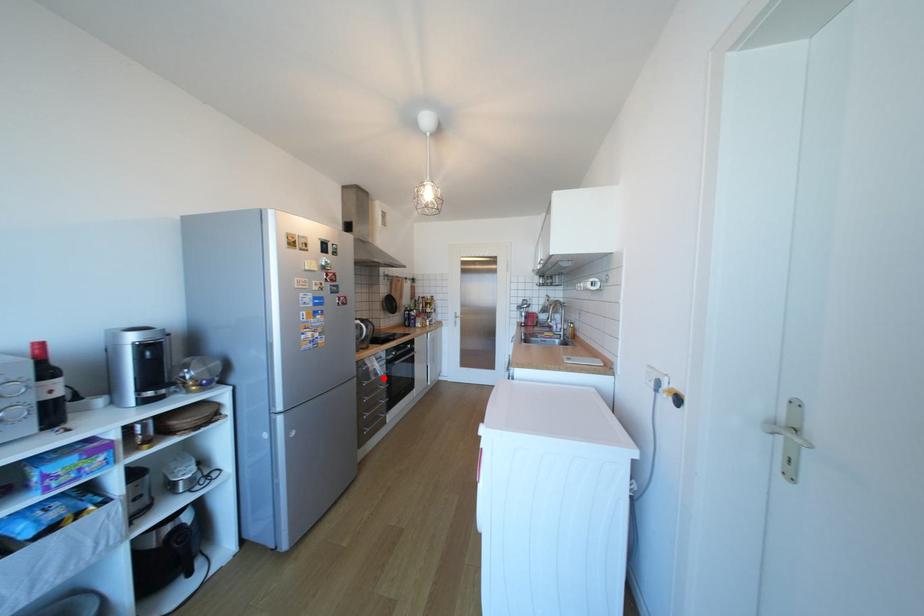
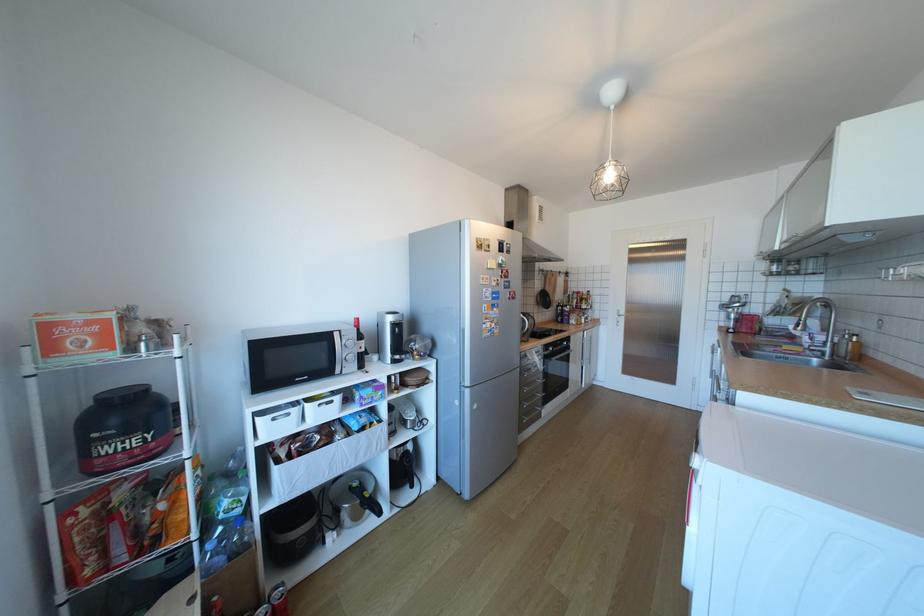
Find the pixel in the second image that matches the highlighted location in the first image.

(543, 371)